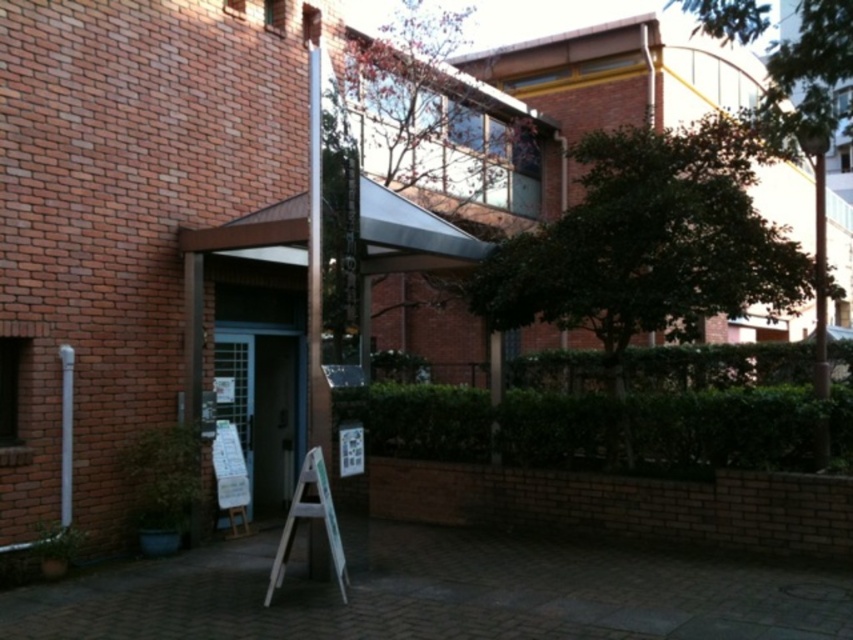
Is point (317, 211) positioned behind point (361, 426)?

No, (317, 211) is in front of (361, 426).

Does silver metallic pole at center have a greater width compared to white paper sign at center?

No.

Identify the location of silver metallic pole at center. (315, 269).

Find the location of a particular element. Image resolution: width=853 pixels, height=640 pixels. silver metallic pole at center is located at coordinates (315, 269).

Does point (308, 436) come farther from viewer compared to point (337, 540)?

Yes, point (308, 436) is farther from viewer.

Is silver metallic pole at center above white wood ladder at center?

Yes, silver metallic pole at center is above white wood ladder at center.

In order to click on silver metallic pole at center in this screenshot , I will do `click(315, 269)`.

What do you see at coordinates (309, 516) in the screenshot? This screenshot has height=640, width=853. I see `white wood ladder at center` at bounding box center [309, 516].

Is point (280, 544) farther from camera compared to point (341, 460)?

No.

Locate an element on the screen. Image resolution: width=853 pixels, height=640 pixels. white wood ladder at center is located at coordinates click(309, 516).